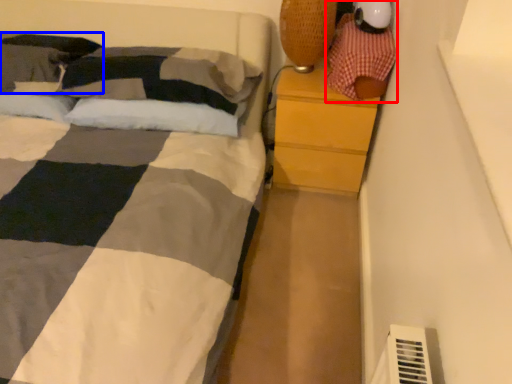
Question: Which object is closer to the camera taking this photo, toy (highlighted by a red box) or pillow (highlighted by a blue box)?

Choices:
 (A) toy
 (B) pillow

Answer: (A)